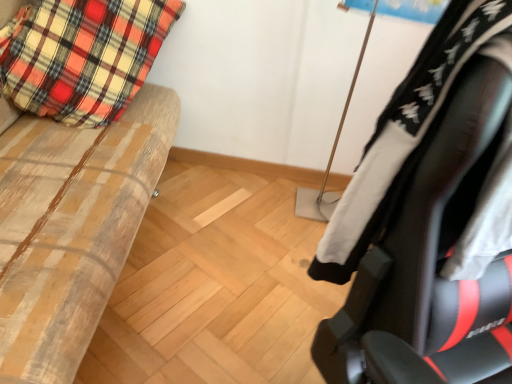
Question: Would you say black leather chair at right is part of plaid fabric pillow at left's contents?

Choices:
 (A) yes
 (B) no

Answer: (B)

Question: Considering the relative sizes of plaid fabric pillow at left and black leather chair at right in the image provided, is plaid fabric pillow at left shorter than black leather chair at right?

Choices:
 (A) no
 (B) yes

Answer: (A)

Question: Considering the relative positions of plaid fabric pillow at left and black leather chair at right in the image provided, is plaid fabric pillow at left to the left of black leather chair at right from the viewer's perspective?

Choices:
 (A) yes
 (B) no

Answer: (A)

Question: Does plaid fabric pillow at left come behind black leather chair at right?

Choices:
 (A) yes
 (B) no

Answer: (A)

Question: From a real-world perspective, is plaid fabric pillow at left located beneath black leather chair at right?

Choices:
 (A) yes
 (B) no

Answer: (A)

Question: In the image, is black leather chair at right on the left side or the right side of plaid fabric pillow at left?

Choices:
 (A) left
 (B) right

Answer: (B)

Question: In terms of width, does black leather chair at right look wider or thinner when compared to plaid fabric pillow at left?

Choices:
 (A) thin
 (B) wide

Answer: (A)

Question: From a real-world perspective, is black leather chair at right above or below plaid fabric pillow at left?

Choices:
 (A) above
 (B) below

Answer: (A)

Question: In the image, is black leather chair at right positioned in front of or behind plaid fabric pillow at left?

Choices:
 (A) behind
 (B) front

Answer: (B)

Question: Looking at the image, does wooden bench at left seem bigger or smaller compared to black leather chair at right?

Choices:
 (A) big
 (B) small

Answer: (A)

Question: From their relative heights in the image, would you say wooden bench at left is taller or shorter than black leather chair at right?

Choices:
 (A) tall
 (B) short

Answer: (A)

Question: Relative to black leather chair at right, is wooden bench at left in front or behind?

Choices:
 (A) front
 (B) behind

Answer: (B)

Question: Considering the relative positions of wooden bench at left and black leather chair at right in the image provided, is wooden bench at left to the left or to the right of black leather chair at right?

Choices:
 (A) right
 (B) left

Answer: (B)

Question: In terms of size, does plaid fabric pillow at left appear bigger or smaller than black leather chair at right?

Choices:
 (A) small
 (B) big

Answer: (B)

Question: From a real-world perspective, is plaid fabric pillow at left above or below black leather chair at right?

Choices:
 (A) above
 (B) below

Answer: (B)